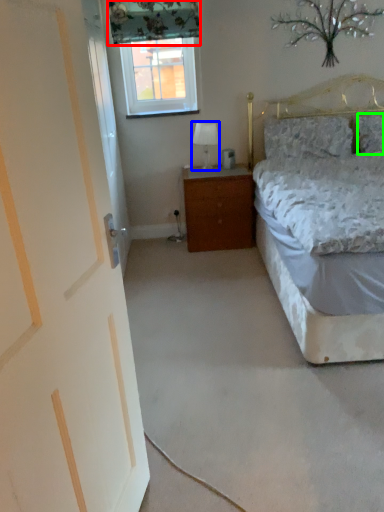
Question: Based on their relative distances, which object is farther from curtain (highlighted by a red box)? Choose from table lamp (highlighted by a blue box) and pillow (highlighted by a green box).

Choices:
 (A) table lamp
 (B) pillow

Answer: (B)